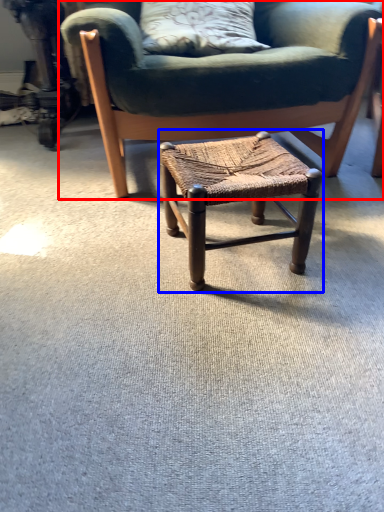
Question: Which point is closer to the camera, chair (highlighted by a red box) or stool (highlighted by a blue box)?

Choices:
 (A) chair
 (B) stool

Answer: (B)